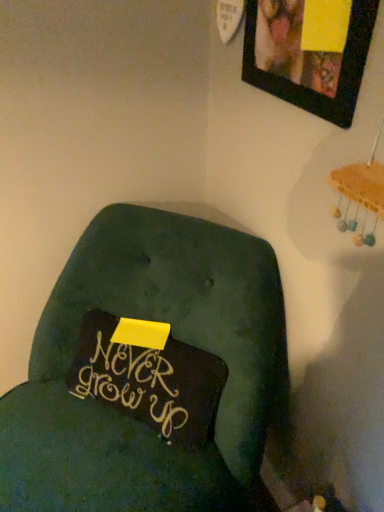
Where is `velvety green cushion at center`? velvety green cushion at center is located at coordinates (149, 373).

Image resolution: width=384 pixels, height=512 pixels. What do you see at coordinates (149, 373) in the screenshot?
I see `velvety green cushion at center` at bounding box center [149, 373].

Image resolution: width=384 pixels, height=512 pixels. What are the coordinates of `matte black picture frame at upper right` in the screenshot? It's located at (306, 58).

What do you see at coordinates (306, 58) in the screenshot? I see `matte black picture frame at upper right` at bounding box center [306, 58].

At what (x,y) coordinates should I click in order to perform the action: click on velvety green cushion at center. Please return your answer as a coordinate pair (x, y). Looking at the image, I should click on pos(149,373).

In the image, is matte black picture frame at upper right on the left side or the right side of velvety green cushion at center?

matte black picture frame at upper right is to the right of velvety green cushion at center.

Between matte black picture frame at upper right and velvety green cushion at center, which one is positioned in front?

velvety green cushion at center is closer to the camera.

Which is less distant, (342, 76) or (3, 494)?

Point (342, 76).

From the image's perspective, which is above, matte black picture frame at upper right or velvety green cushion at center?

matte black picture frame at upper right is shown above in the image.

From a real-world perspective, who is located higher, matte black picture frame at upper right or velvety green cushion at center?

matte black picture frame at upper right.

In the scene shown: Which of these two, matte black picture frame at upper right or velvety green cushion at center, is wider?

velvety green cushion at center.

Considering the sizes of objects matte black picture frame at upper right and velvety green cushion at center in the image provided, who is shorter, matte black picture frame at upper right or velvety green cushion at center?

Standing shorter between the two is matte black picture frame at upper right.

Considering the sizes of objects matte black picture frame at upper right and velvety green cushion at center in the image provided, who is smaller, matte black picture frame at upper right or velvety green cushion at center?

With smaller size is matte black picture frame at upper right.

Would you say matte black picture frame at upper right is outside velvety green cushion at center?

Yes, matte black picture frame at upper right is not within velvety green cushion at center.

Are matte black picture frame at upper right and velvety green cushion at center beside each other?

matte black picture frame at upper right is not next to velvety green cushion at center, and they're not touching.

Is matte black picture frame at upper right looking in the opposite direction of velvety green cushion at center?

No, matte black picture frame at upper right is not facing away from velvety green cushion at center.

Can you tell me how much matte black picture frame at upper right and velvety green cushion at center differ in facing direction?

38.4 degrees separate the facing orientations of matte black picture frame at upper right and velvety green cushion at center.

Measure the distance from matte black picture frame at upper right to velvety green cushion at center.

matte black picture frame at upper right and velvety green cushion at center are 23.29 inches apart.

Where is `picture frame located above the velvety green cushion at center (from the image's perspective)`? Image resolution: width=384 pixels, height=512 pixels. picture frame located above the velvety green cushion at center (from the image's perspective) is located at coordinates (306, 58).

Based on their positions, is velvety green cushion at center located to the left or right of matte black picture frame at upper right?

Clearly, velvety green cushion at center is on the left of matte black picture frame at upper right in the image.

Considering the positions of objects velvety green cushion at center and matte black picture frame at upper right in the image provided, who is in front, velvety green cushion at center or matte black picture frame at upper right?

velvety green cushion at center is more forward.

Is point (209, 373) closer to viewer compared to point (333, 57)?

That is False.

From the image's perspective, between velvety green cushion at center and matte black picture frame at upper right, which one is located above?

matte black picture frame at upper right appears higher in the image.

From a real-world perspective, is velvety green cushion at center physically above matte black picture frame at upper right?

No, from a real-world perspective, velvety green cushion at center is not on top of matte black picture frame at upper right.

Looking at their sizes, would you say velvety green cushion at center is wider or thinner than matte black picture frame at upper right?

Considering their sizes, velvety green cushion at center looks broader than matte black picture frame at upper right.

Considering the relative sizes of velvety green cushion at center and matte black picture frame at upper right in the image provided, is velvety green cushion at center taller than matte black picture frame at upper right?

Indeed, velvety green cushion at center has a greater height compared to matte black picture frame at upper right.

Considering the sizes of objects velvety green cushion at center and matte black picture frame at upper right in the image provided, who is smaller, velvety green cushion at center or matte black picture frame at upper right?

matte black picture frame at upper right.

Is velvety green cushion at center inside or outside of matte black picture frame at upper right?

velvety green cushion at center is not inside matte black picture frame at upper right, it's outside.

Is velvety green cushion at center far away from matte black picture frame at upper right?

No.

Is velvety green cushion at center turned away from matte black picture frame at upper right?

No, velvety green cushion at center's orientation is not away from matte black picture frame at upper right.

Measure the distance between velvety green cushion at center and matte black picture frame at upper right.

They are 23.29 inches apart.

Identify the location of furniture in front of the matte black picture frame at upper right. (149, 373).

Identify the location of furniture on the left of matte black picture frame at upper right. The height and width of the screenshot is (512, 384). (149, 373).

Identify the location of picture frame above the velvety green cushion at center (from the image's perspective). The width and height of the screenshot is (384, 512). (306, 58).